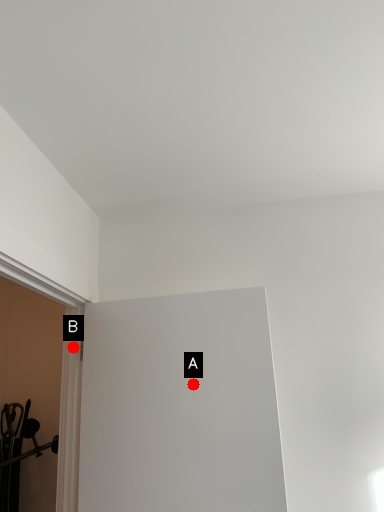
Question: Two points are circled on the image, labeled by A and B beside each circle. Which point is further to the camera?

Choices:
 (A) A is further
 (B) B is further

Answer: (B)